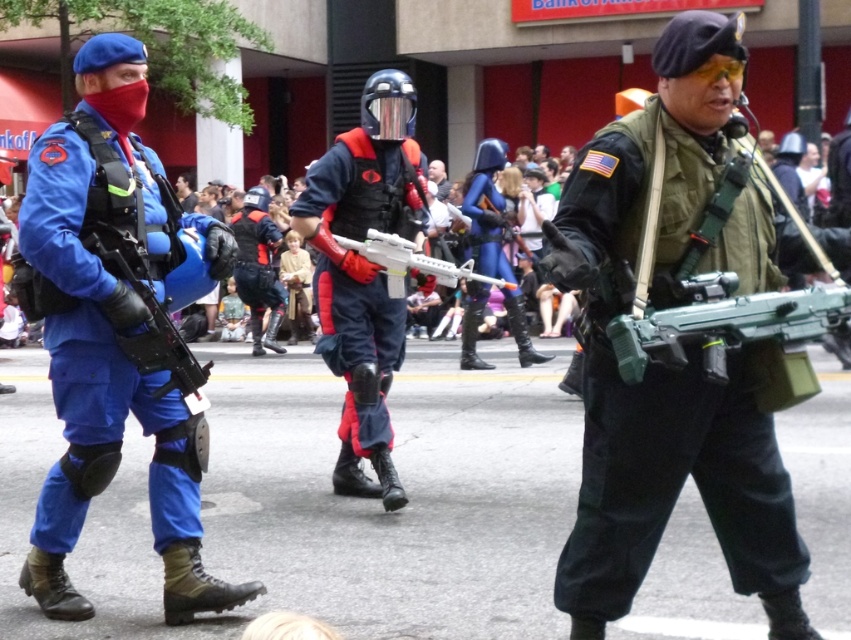
You are a child who wants to play with the green plastic toy gun at center and the white plastic toy gun at center. Which one is closer to your right hand if both are placed at the center?

The green plastic toy gun at center is to the right of the white plastic toy gun at center, so the green plastic toy gun at center is closer to your right hand.

You are a photographer trying to capture a clear photo of the matte blue uniform at left and the green plastic toy gun at center. Since you can only focus on one object at a time, which object should you focus on to ensure the other is still in the background?

You should focus on the matte blue uniform at left because the green plastic toy gun at center is behind it, so it will naturally be in the background.

You are a photographer trying to capture a clear photo of the matte green vest at center and the white plastic toy gun at center. Which object will appear closer to the camera in the photo?

The matte green vest at center will appear closer to the camera in the photo because it is positioned in front of the white plastic toy gun at center.